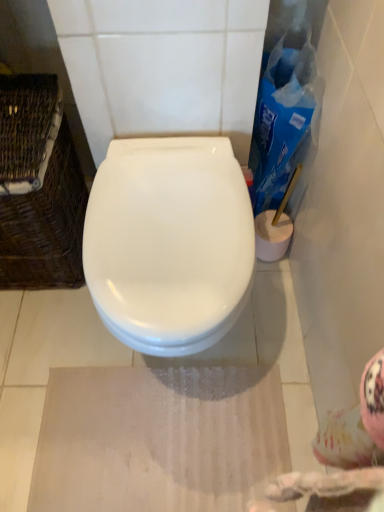
Question: Considering the relative sizes of woven brown basket at left and white glossy toilet at center in the image provided, is woven brown basket at left thinner than white glossy toilet at center?

Choices:
 (A) yes
 (B) no

Answer: (A)

Question: Is woven brown basket at left looking in the opposite direction of white glossy toilet at center?

Choices:
 (A) no
 (B) yes

Answer: (A)

Question: Are woven brown basket at left and white glossy toilet at center beside each other?

Choices:
 (A) no
 (B) yes

Answer: (A)

Question: Can we say woven brown basket at left lies outside white glossy toilet at center?

Choices:
 (A) no
 (B) yes

Answer: (B)

Question: Does woven brown basket at left have a lesser height compared to white glossy toilet at center?

Choices:
 (A) no
 (B) yes

Answer: (A)

Question: Considering the positions of woven brown basket at left and white glossy toilet at center in the image, is woven brown basket at left wider or thinner than white glossy toilet at center?

Choices:
 (A) thin
 (B) wide

Answer: (A)

Question: Is point (29, 269) closer or farther from the camera than point (190, 140)?

Choices:
 (A) closer
 (B) farther

Answer: (B)

Question: Visually, is woven brown basket at left positioned to the left or to the right of white glossy toilet at center?

Choices:
 (A) left
 (B) right

Answer: (A)

Question: Choose the correct answer: Is woven brown basket at left inside white glossy toilet at center or outside it?

Choices:
 (A) outside
 (B) inside

Answer: (A)

Question: Considering the positions of point (278, 144) and point (8, 272), is point (278, 144) closer or farther from the camera than point (8, 272)?

Choices:
 (A) closer
 (B) farther

Answer: (A)

Question: Would you say blue plastic cleaning product at right is to the left or to the right of woven brown basket at left in the picture?

Choices:
 (A) left
 (B) right

Answer: (B)

Question: From a real-world perspective, is blue plastic cleaning product at right positioned above or below woven brown basket at left?

Choices:
 (A) below
 (B) above

Answer: (B)

Question: Considering the positions of blue plastic cleaning product at right and woven brown basket at left in the image, is blue plastic cleaning product at right wider or thinner than woven brown basket at left?

Choices:
 (A) thin
 (B) wide

Answer: (A)

Question: From a real-world perspective, is white glossy toilet at center positioned above or below woven brown basket at left?

Choices:
 (A) above
 (B) below

Answer: (B)

Question: Is white glossy toilet at center spatially inside woven brown basket at left, or outside of it?

Choices:
 (A) inside
 (B) outside

Answer: (B)